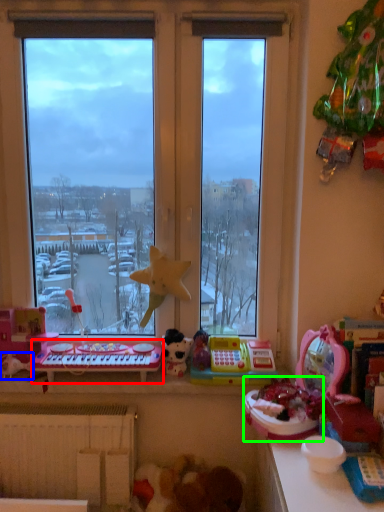
Question: Which object is positioned farthest from musical keyboard (highlighted by a red box)? Select from toy (highlighted by a blue box) and toy (highlighted by a green box).

Choices:
 (A) toy
 (B) toy

Answer: (B)